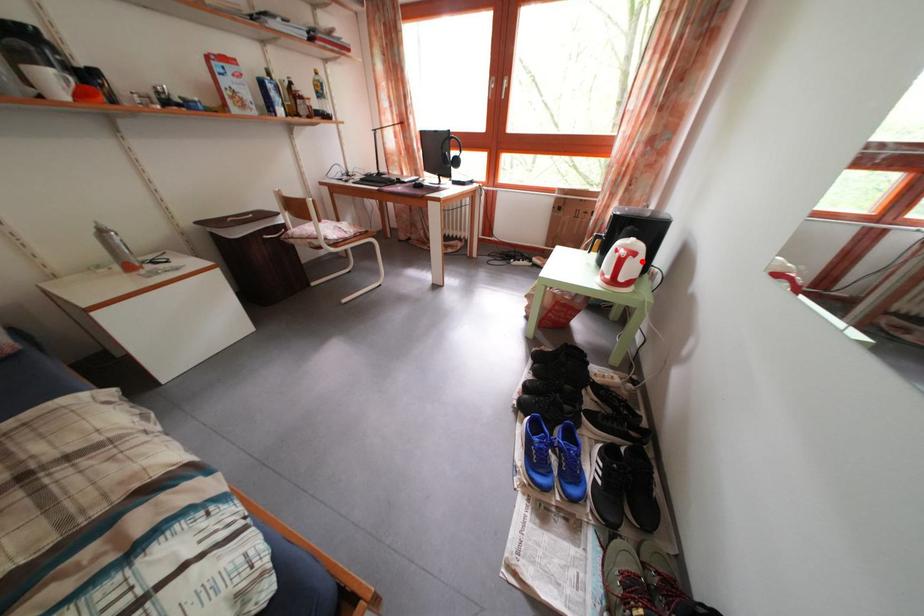
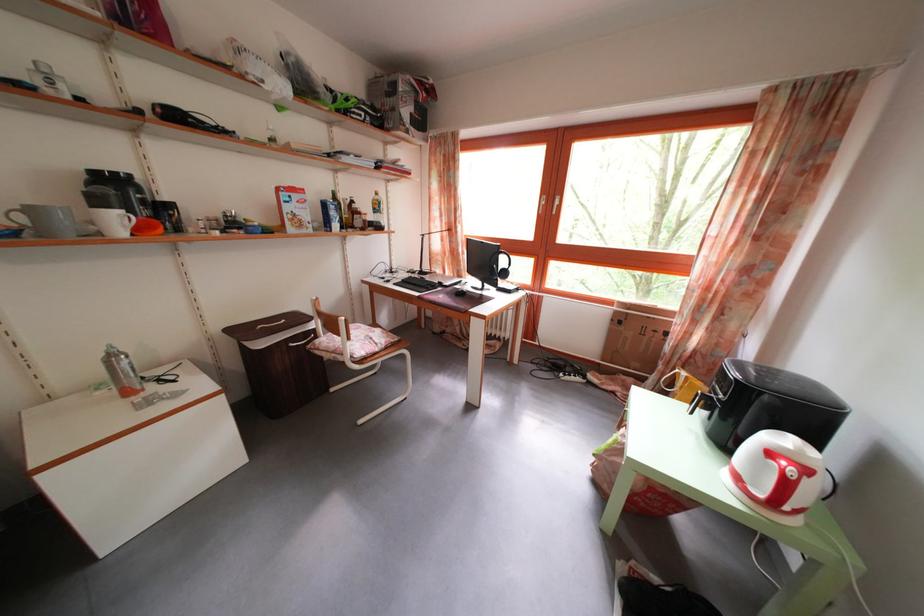
Where in the second image is the point corresponding to the highlighted location from the first image?

(812, 477)